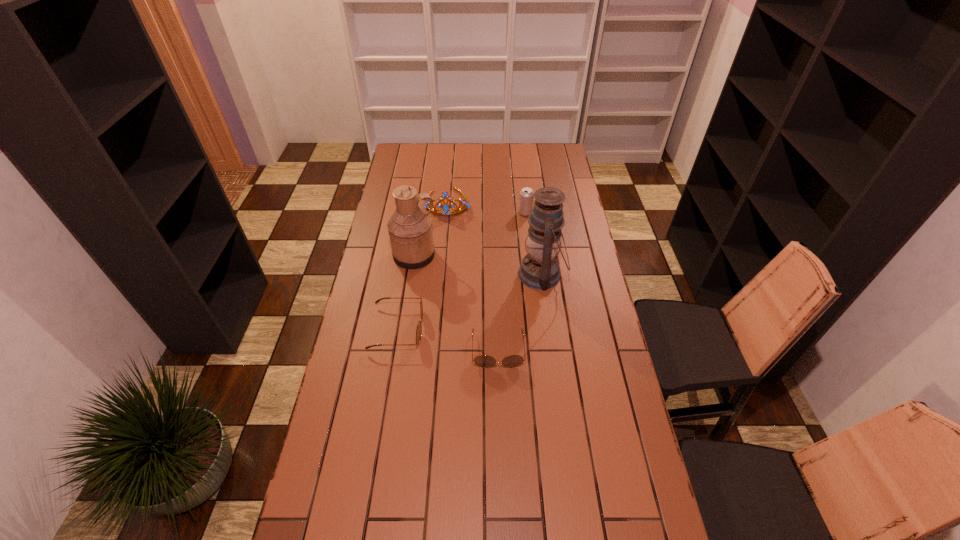
Identify the location of free spot located on the front-facing side of the tiara. The height and width of the screenshot is (540, 960). (443, 268).

Find the location of a particular element. This screenshot has height=540, width=960. blank area located on the left of the beer can is located at coordinates (490, 213).

Identify the location of free point located 0.130m on the left of the oil lamp. The height and width of the screenshot is (540, 960). (485, 274).

Where is `vacant space located on the right of the pitcher`? The width and height of the screenshot is (960, 540). vacant space located on the right of the pitcher is located at coordinates (500, 255).

Where is `sunglasses located in the left edge section of the desktop`? The width and height of the screenshot is (960, 540). sunglasses located in the left edge section of the desktop is located at coordinates (419, 328).

What are the coordinates of `pitcher at the left edge` in the screenshot? It's located at (410, 228).

The image size is (960, 540). I want to click on object that is at the right edge, so pos(539,269).

I want to click on free space at the far edge of the desktop, so click(x=500, y=146).

In the image, there is a desktop. Where is `vacant space at the near edge`? This screenshot has width=960, height=540. vacant space at the near edge is located at coordinates (430, 511).

In order to click on free space at the left edge of the desktop in this screenshot , I will do `click(358, 366)`.